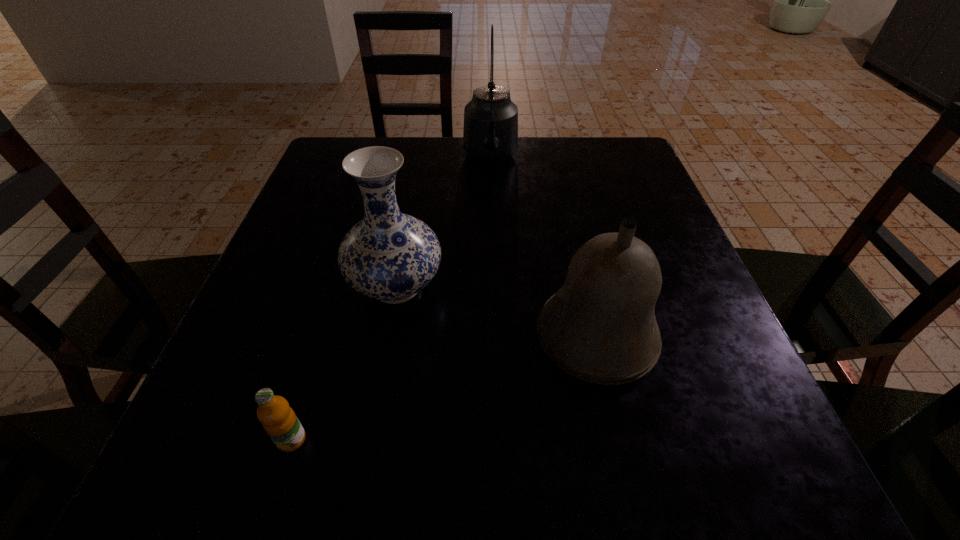
Image resolution: width=960 pixels, height=540 pixels. Find the location of `free point that satisfies the following two spatial constraints: 1. spout on the bell; 2. on the left side of the farthest object`. free point that satisfies the following two spatial constraints: 1. spout on the bell; 2. on the left side of the farthest object is located at coordinates (496, 338).

You are a GUI agent. You are given a task and a screenshot of the screen. Output one action in this format:
    pyautogui.click(x=<x>, y=<y>)
    Task: Click on the vacant space that satisfies the following two spatial constraints: 1. spout on the bell; 2. on the right side of the farthest object
    The image size is (960, 540).
    Given the screenshot: What is the action you would take?
    pyautogui.click(x=496, y=338)

Where is `free spot that satisfies the following two spatial constraints: 1. on the front side of the bell; 2. on the left side of the vase`? This screenshot has width=960, height=540. free spot that satisfies the following two spatial constraints: 1. on the front side of the bell; 2. on the left side of the vase is located at coordinates (387, 338).